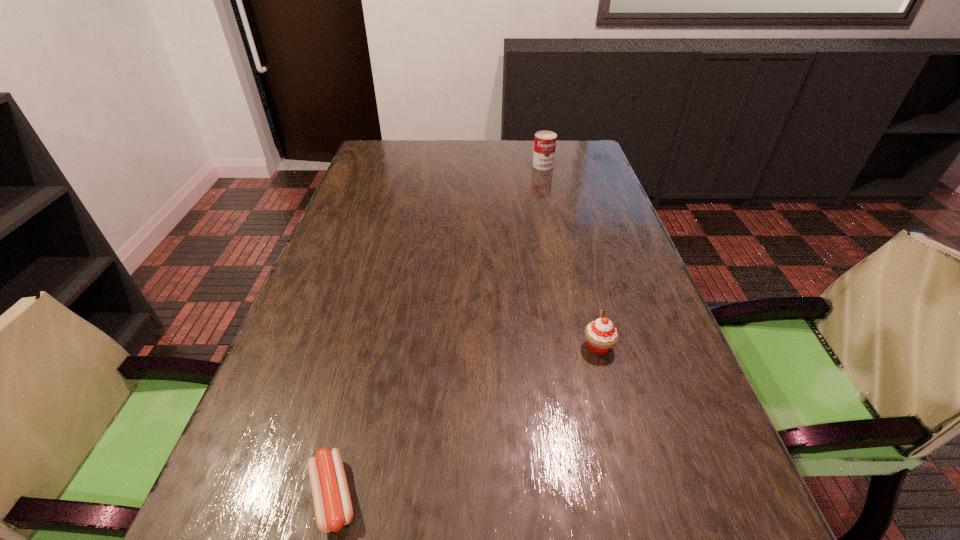
Locate an element on the screen. The width and height of the screenshot is (960, 540). the farthest object is located at coordinates (545, 141).

You are a GUI agent. You are given a task and a screenshot of the screen. Output one action in this format:
    pyautogui.click(x=<x>, y=<y>)
    Task: Click on the tallest object
    This screenshot has height=540, width=960.
    Given the screenshot: What is the action you would take?
    pyautogui.click(x=545, y=141)

You are a GUI agent. You are given a task and a screenshot of the screen. Output one action in this format:
    pyautogui.click(x=<x>, y=<y>)
    Task: Click on the second farthest object
    Image resolution: width=960 pixels, height=540 pixels.
    Given the screenshot: What is the action you would take?
    pyautogui.click(x=601, y=335)

In order to click on the second tallest object in this screenshot , I will do click(601, 335).

You are a GUI agent. You are given a task and a screenshot of the screen. Output one action in this format:
    pyautogui.click(x=<x>, y=<y>)
    Task: Click on the sausage
    
    Given the screenshot: What is the action you would take?
    pyautogui.click(x=333, y=508)

What are the coordinates of `the nearest object` in the screenshot? It's located at (333, 508).

Where is `free space located on the front label of the farthest object`? The height and width of the screenshot is (540, 960). free space located on the front label of the farthest object is located at coordinates (552, 206).

Where is `blank space located on the back of the cupcake`? The height and width of the screenshot is (540, 960). blank space located on the back of the cupcake is located at coordinates (571, 241).

Locate an element on the screen. free spot located 0.170m on the right of the nearest object is located at coordinates (472, 495).

Where is `object that is at the far edge`? object that is at the far edge is located at coordinates (545, 141).